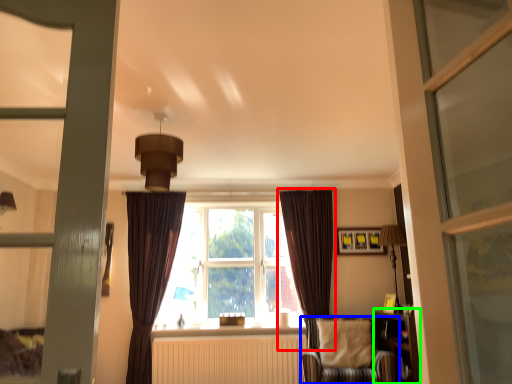
Question: Which is farther away from curtain (highlighted by a red box)? chair (highlighted by a blue box) or bookshelf (highlighted by a green box)?

Choices:
 (A) chair
 (B) bookshelf

Answer: (B)